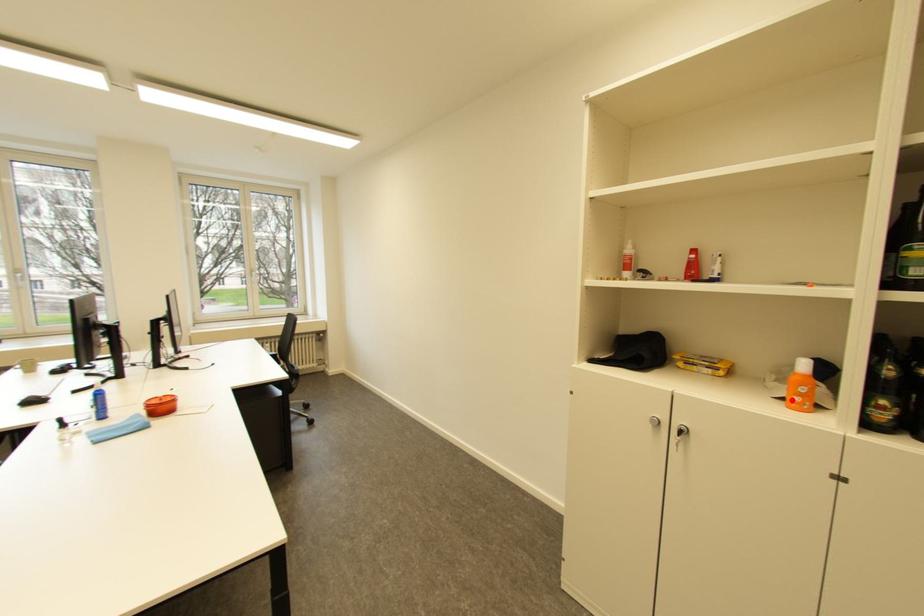
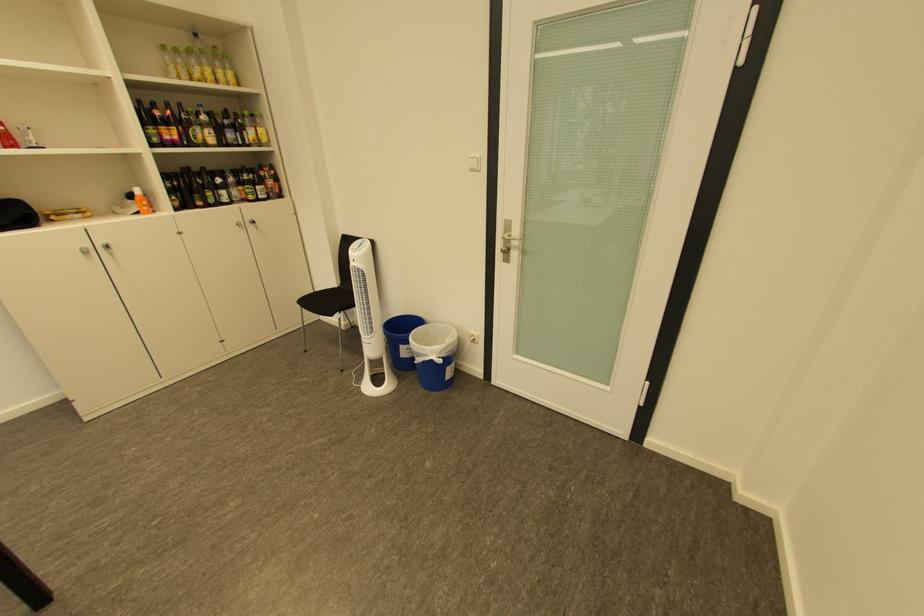
Find the pixel in the second image that matches the highlighted location in the first image.

(148, 214)